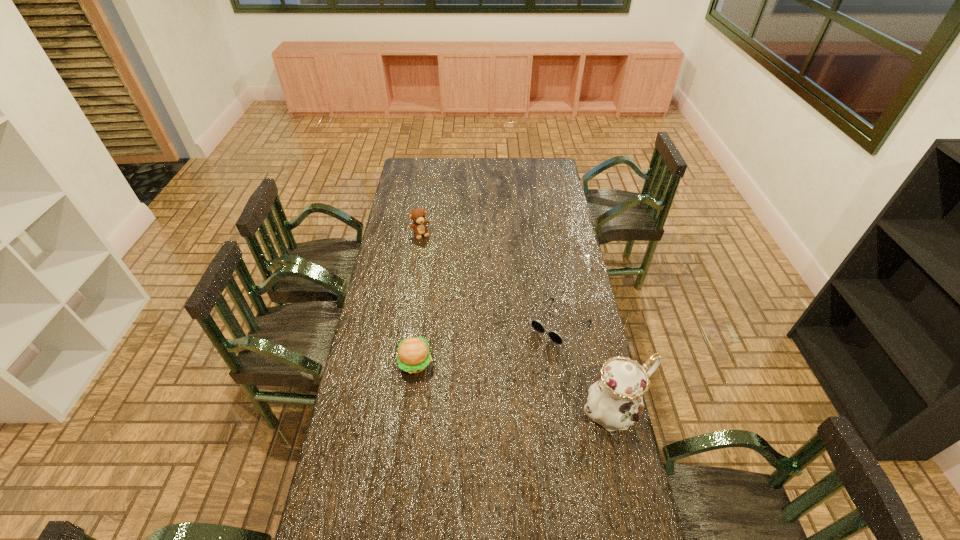
Locate an element on the screen. The height and width of the screenshot is (540, 960). hamburger is located at coordinates tap(413, 356).

Find the location of a particular element. the tallest object is located at coordinates (615, 401).

This screenshot has height=540, width=960. Find the location of `the nearest object`. the nearest object is located at coordinates pyautogui.click(x=615, y=401).

I want to click on the shortest object, so click(x=536, y=324).

Image resolution: width=960 pixels, height=540 pixels. Find the location of `the farthest object`. the farthest object is located at coordinates (417, 215).

The image size is (960, 540). I want to click on teddy bear, so click(417, 215).

The width and height of the screenshot is (960, 540). Identify the location of free space located 0.170m on the back of the third tallest object. (421, 312).

Where is `free space located on the left of the chinaware`? free space located on the left of the chinaware is located at coordinates (481, 411).

Identify the location of blank space located 0.340m on the front-facing side of the sunglasses. The image size is (960, 540). (483, 403).

Image resolution: width=960 pixels, height=540 pixels. What are the coordinates of `vacant area located on the front-facing side of the sunglasses` in the screenshot? It's located at (515, 370).